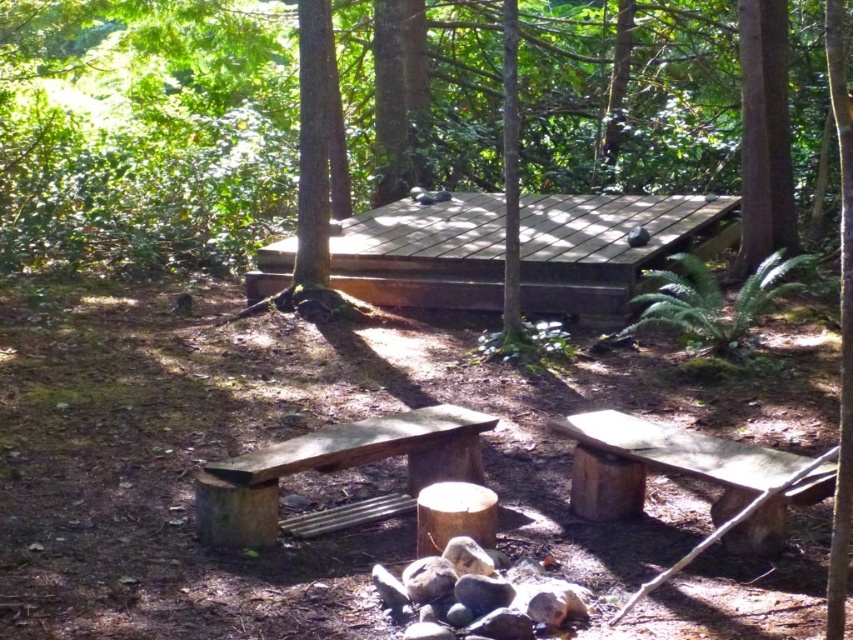
Is the position of wooden bench at lower right more distant than that of brown wood bench at center?

No, wooden bench at lower right is in front of brown wood bench at center.

Locate an element on the screen. wooden bench at lower right is located at coordinates (660, 464).